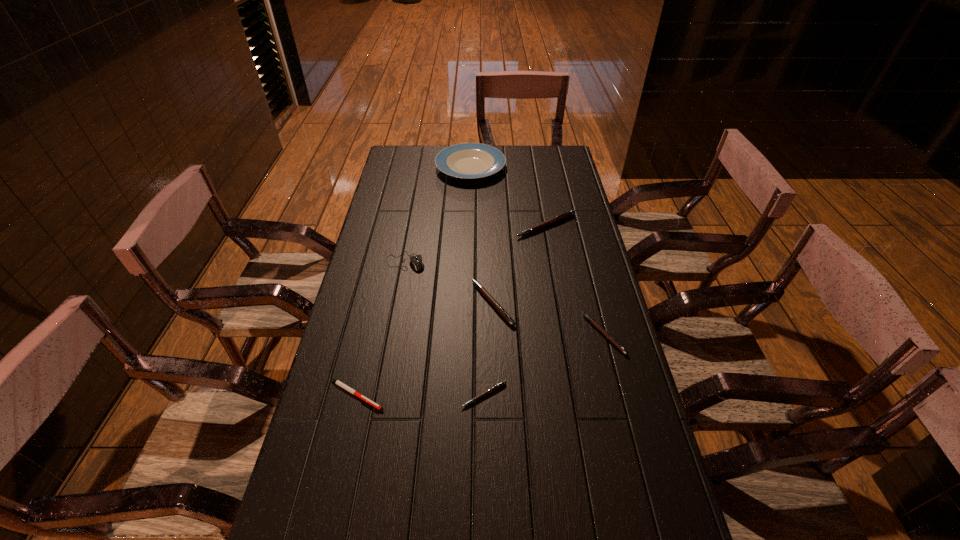
Locate an element on the screen. Image resolution: width=960 pixels, height=540 pixels. pink pen that is the closest to the farthest pen is located at coordinates (497, 306).

Where is `pink pen that is the second nearest to the leftmost pen`? The width and height of the screenshot is (960, 540). pink pen that is the second nearest to the leftmost pen is located at coordinates (497, 306).

Identify the location of vacant space that satisfies the following two spatial constraints: 1. at the nib of the second tallest pen; 2. at the nib of the smallest pink pen. (495, 395).

The height and width of the screenshot is (540, 960). Identify the location of free space that satisfies the following two spatial constraints: 1. at the nib of the farthest pink pen; 2. at the nib of the fourth shortest object. (559, 303).